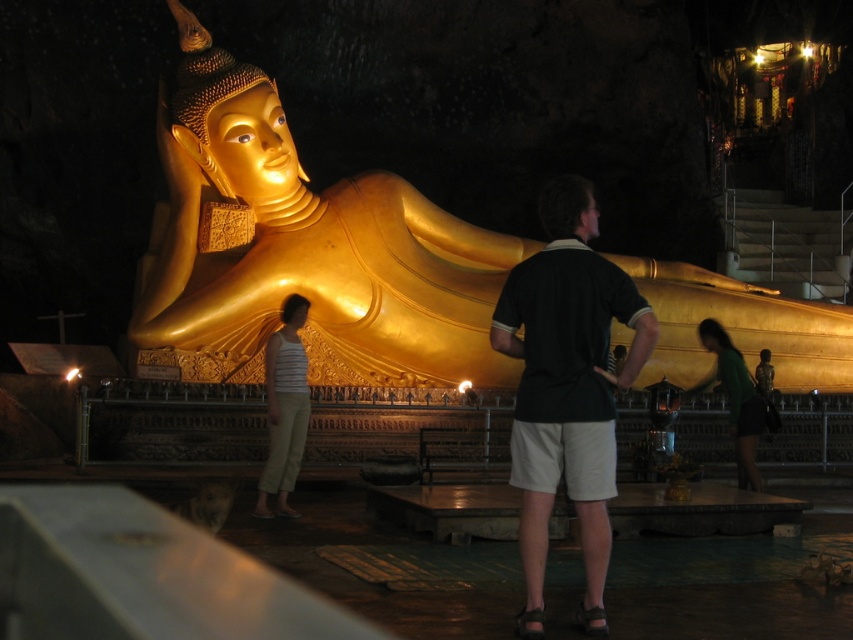
Does gold polished statue at center appear over striped tank top at center?

Correct, gold polished statue at center is located above striped tank top at center.

Does point (381, 298) lie in front of point (270, 424)?

No.

Measure the distance between point (257, 186) and camera.

Point (257, 186) and camera are 69.21 meters apart.

Image resolution: width=853 pixels, height=640 pixels. I want to click on gold polished statue at center, so click(305, 250).

Who is more forward, (567, 419) or (752, 458)?

Point (567, 419) is in front.

Is point (569, 214) closer to viewer compared to point (740, 400)?

Yes, it is.

I want to click on black cotton polo shirt at center, so click(567, 387).

Is gold polished statue at center positioned in front of green matte shirt at lower right?

Yes, gold polished statue at center is closer to the viewer.

Does gold polished statue at center have a lesser height compared to green matte shirt at lower right?

Incorrect, gold polished statue at center's height does not fall short of green matte shirt at lower right's.

You are a GUI agent. You are given a task and a screenshot of the screen. Output one action in this format:
    pyautogui.click(x=<x>, y=<y>)
    Task: Click on the gold polished statue at center
    The height and width of the screenshot is (640, 853).
    Given the screenshot: What is the action you would take?
    pyautogui.click(x=305, y=250)